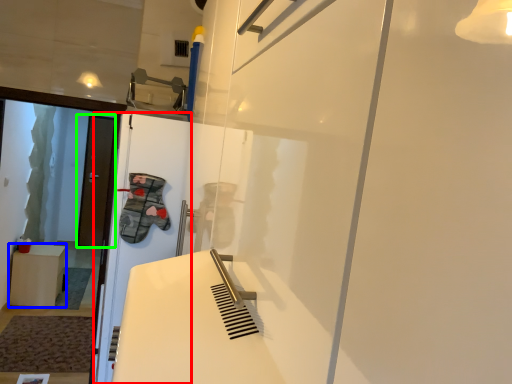
Question: Which object is positioned farthest from screen door (highlighted by a red box)? Select from furniture (highlighted by a blue box) and door (highlighted by a green box).

Choices:
 (A) furniture
 (B) door

Answer: (B)